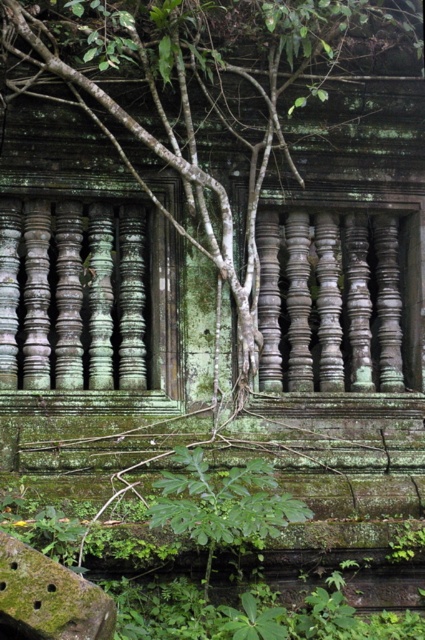
Question: Which point is closer to the camera?

Choices:
 (A) (249, 534)
 (B) (20, 51)

Answer: (A)

Question: Which point is farther from the camera taking this photo?

Choices:
 (A) (285, 522)
 (B) (178, 112)

Answer: (B)

Question: Observing the image, what is the correct spatial positioning of green mossy tree at center in reference to green leafy plant at lower center?

Choices:
 (A) above
 (B) below

Answer: (A)

Question: Is green mossy tree at center bigger than green leafy plant at lower center?

Choices:
 (A) yes
 (B) no

Answer: (A)

Question: Which of the following is the closest to the observer?

Choices:
 (A) (59, 381)
 (B) (282, 508)

Answer: (B)

Question: Does green mossy tree at center have a greater width compared to green leafy plant at lower center?

Choices:
 (A) yes
 (B) no

Answer: (A)